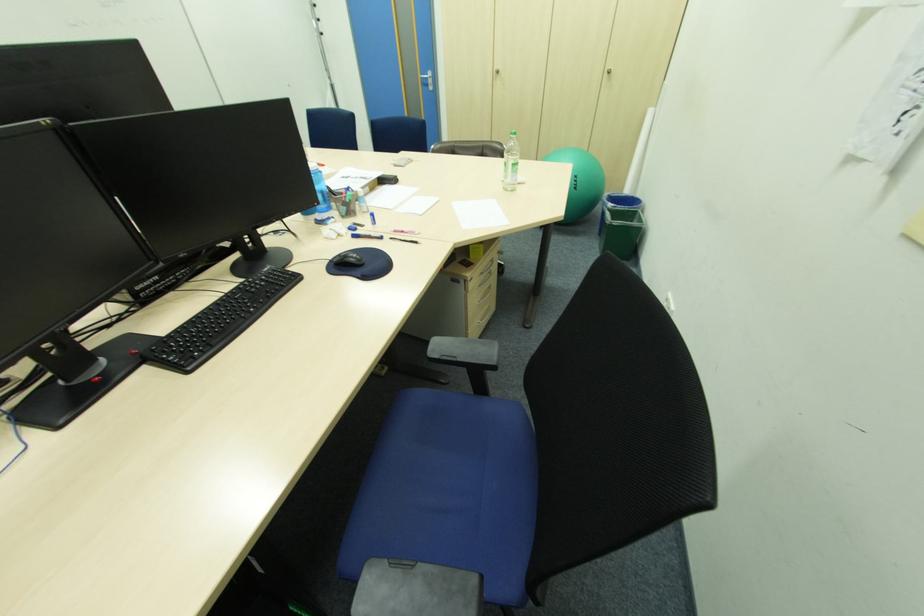
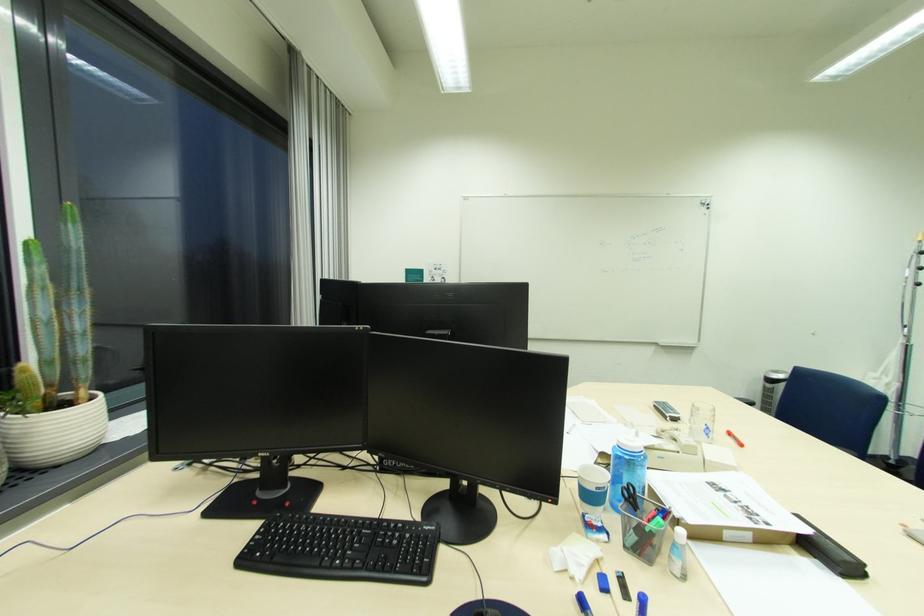
In the second image, find the point that corresponds to [370,225] in the first image.

(636, 601)